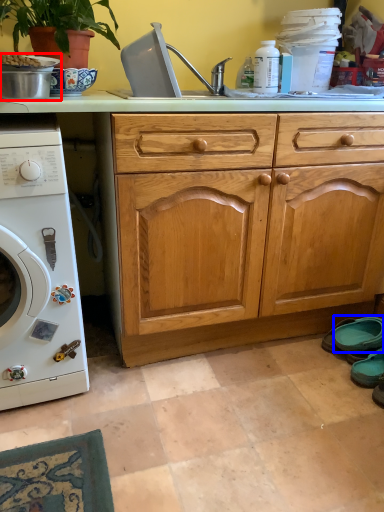
Question: Among these objects, which one is farthest to the camera, appliance (highlighted by a red box) or shoe (highlighted by a blue box)?

Choices:
 (A) appliance
 (B) shoe

Answer: (B)